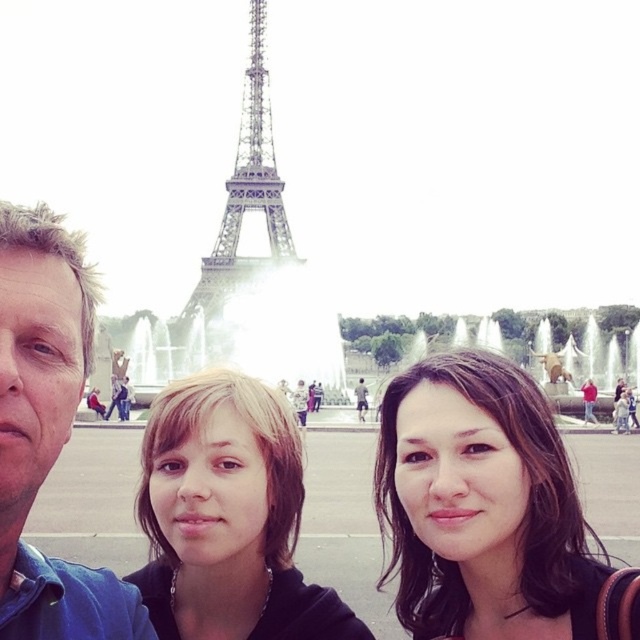
You are a photographer trying to take a clear photo of the Eiffel Tower. You notice two people in the way, the dark brown hair at center and the blue fabric shirt at left. Which person should you ask to move so you can get a better shot of the Eiffel Tower?

The dark brown hair at center is closer to you than the blue fabric shirt at left, so you should ask the dark brown hair at center to move first to get a clearer view of the Eiffel Tower.

You are a photographer trying to capture a group photo at the Trocadero Square with the Eiffel Tower in the background. You notice the dark brown hair at center and the blue fabric shirt at left in your frame. Which object would you adjust to ensure proper framing if you want to focus on the wider subject?

The dark brown hair at center might be wider than the blue fabric shirt at left, so you should adjust the dark brown hair at center to ensure proper framing.

You are a photographer trying to capture a group photo with the Eiffel Tower in the background. You have the blue fabric shirt at left and the metallic silver eiffel tower at center in your frame. Based on their sizes in the photo, which object would appear closer to the camera?

The blue fabric shirt at left appears closer to the camera because it is smaller than the metallic silver eiffel tower at center, which suggests it is farther away.